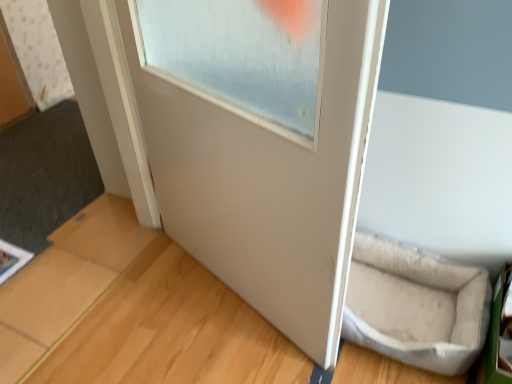
Find the location of a particular element. This screenshot has height=384, width=512. white matte door frame at upper left is located at coordinates (121, 104).

What do you see at coordinates (415, 307) in the screenshot? I see `beige fabric pet bed at lower right` at bounding box center [415, 307].

Find the location of a particular element. This screenshot has width=512, height=384. light brown wood at lower right is located at coordinates (172, 331).

What are the coordinates of `white matte door frame at upper left` in the screenshot? It's located at (121, 104).

Does light brown wood at lower right appear on the left side of white matte door frame at upper left?

Incorrect, light brown wood at lower right is not on the left side of white matte door frame at upper left.

Which of these two, light brown wood at lower right or white matte door frame at upper left, is wider?

light brown wood at lower right.

Can you confirm if light brown wood at lower right is smaller than white matte door frame at upper left?

Correct, light brown wood at lower right occupies less space than white matte door frame at upper left.

Can you confirm if light brown wood at lower right is shorter than white matte door frame at upper left?

Indeed, light brown wood at lower right has a lesser height compared to white matte door frame at upper left.

From a real-world perspective, is beige fabric pet bed at lower right on top of white matte door at center?

Actually, beige fabric pet bed at lower right is physically below white matte door at center in the real world.

Which object is more forward, beige fabric pet bed at lower right or white matte door at center?

white matte door at center.

Measure the distance from beige fabric pet bed at lower right to white matte door at center.

48.42 centimeters.

Considering the relative sizes of beige fabric pet bed at lower right and white matte door at center in the image provided, is beige fabric pet bed at lower right shorter than white matte door at center?

Yes.

Which object is more forward, white matte door frame at upper left or light brown wood at lower right?

light brown wood at lower right.

Which is more to the left, white matte door frame at upper left or light brown wood at lower right?

From the viewer's perspective, white matte door frame at upper left appears more on the left side.

From the image's perspective, which object appears higher, white matte door frame at upper left or light brown wood at lower right?

white matte door frame at upper left appears higher in the image.

Is white matte door frame at upper left taller than light brown wood at lower right?

Yes.

From the picture: Is light brown wood at lower right not near white matte door at center?

That's not correct — light brown wood at lower right is a little close to white matte door at center.

Locate an element on the screen. The width and height of the screenshot is (512, 384). door positioned vertically above the light brown wood at lower right (from a real-world perspective) is located at coordinates (261, 143).

From the picture: Who is taller, light brown wood at lower right or white matte door at center?

white matte door at center is taller.

Is light brown wood at lower right located outside white matte door at center?

Yes, light brown wood at lower right is outside of white matte door at center.

Based on the photo, who is shorter, white matte door at center or white matte door frame at upper left?

With less height is white matte door frame at upper left.

In terms of size, does white matte door at center appear bigger or smaller than white matte door frame at upper left?

Clearly, white matte door at center is larger in size than white matte door frame at upper left.

Looking at this image, are white matte door at center and white matte door frame at upper left located far from each other?

They are positioned close to each other.

Identify the location of window frame that appears above the white matte door at center (from the image's perspective). The image size is (512, 384). tap(121, 104).

Is beige fabric pet bed at lower right positioned far away from white matte door frame at upper left?

No, beige fabric pet bed at lower right is in close proximity to white matte door frame at upper left.

Locate an element on the screen. wide in front of the white matte door frame at upper left is located at coordinates (415, 307).

From a real-world perspective, which is physically below, beige fabric pet bed at lower right or white matte door frame at upper left?

beige fabric pet bed at lower right is physically lower.

Is beige fabric pet bed at lower right closer to camera compared to white matte door frame at upper left?

Yes.

Is white matte door frame at upper left situated inside white matte door at center or outside?

white matte door frame at upper left is spatially situated outside white matte door at center.

From a real-world perspective, relative to white matte door at center, is white matte door frame at upper left vertically above or below?

white matte door frame at upper left is below white matte door at center.

Which is more to the left, white matte door frame at upper left or white matte door at center?

white matte door frame at upper left.

Is point (124, 109) less distant than point (294, 18)?

No.

The image size is (512, 384). What are the coordinates of `window frame behind the light brown wood at lower right` in the screenshot? It's located at (121, 104).

I want to click on door positioned vertically above the beige fabric pet bed at lower right (from a real-world perspective), so click(x=261, y=143).

Which object lies nearer to the anchor point beige fabric pet bed at lower right, white matte door at center or light brown wood at lower right?

light brown wood at lower right.

From the image, which object appears to be farther from white matte door frame at upper left, beige fabric pet bed at lower right or light brown wood at lower right?

beige fabric pet bed at lower right lies further to white matte door frame at upper left than the other object.

When comparing their distances from light brown wood at lower right, does white matte door frame at upper left or white matte door at center seem closer?

Based on the image, white matte door at center appears to be nearer to light brown wood at lower right.

When comparing their distances from light brown wood at lower right, does beige fabric pet bed at lower right or white matte door frame at upper left seem closer?

white matte door frame at upper left.

Which object lies further to the anchor point beige fabric pet bed at lower right, white matte door frame at upper left or white matte door at center?

Based on the image, white matte door frame at upper left appears to be further to beige fabric pet bed at lower right.

Which object lies nearer to the anchor point white matte door at center, beige fabric pet bed at lower right or light brown wood at lower right?

light brown wood at lower right is closer to white matte door at center.

When comparing their distances from white matte door frame at upper left, does light brown wood at lower right or beige fabric pet bed at lower right seem closer?

Result: Based on the image, light brown wood at lower right appears to be nearer to white matte door frame at upper left.

From the image, which object appears to be farther from beige fabric pet bed at lower right, light brown wood at lower right or white matte door frame at upper left?

white matte door frame at upper left.

Find the location of `wide between white matte door at center and light brown wood at lower right from top to bottom`. wide between white matte door at center and light brown wood at lower right from top to bottom is located at coordinates (415, 307).

The image size is (512, 384). Identify the location of door between white matte door frame at upper left and light brown wood at lower right from top to bottom. (261, 143).

This screenshot has width=512, height=384. I want to click on wood between white matte door frame at upper left and beige fabric pet bed at lower right from left to right, so click(x=172, y=331).

Locate an element on the screen. This screenshot has height=384, width=512. door between white matte door frame at upper left and beige fabric pet bed at lower right is located at coordinates (261, 143).